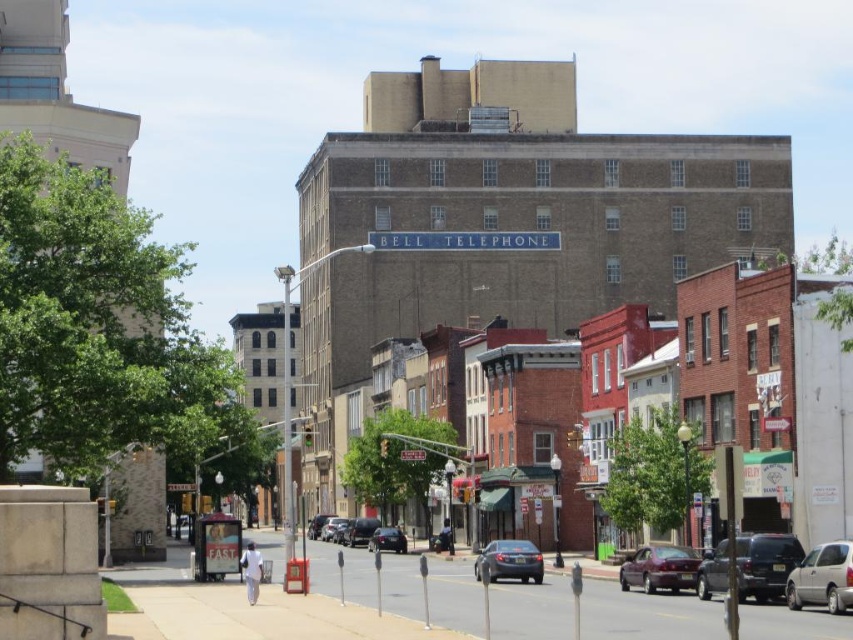
Is the position of gray asphalt at center less distant than that of shiny black car at center?

That is True.

Is point (413, 582) positioned after point (376, 525)?

No, (413, 582) is in front of (376, 525).

What do you see at coordinates (218, 588) in the screenshot? I see `gray asphalt at center` at bounding box center [218, 588].

In order to click on gray asphalt at center in this screenshot , I will do `click(218, 588)`.

Describe the element at coordinates (659, 568) in the screenshot. I see `shiny maroon sedan at lower right` at that location.

Between shiny maroon sedan at lower right and matte gray sedan at center, which one is positioned higher?

shiny maroon sedan at lower right is above.

You are a GUI agent. You are given a task and a screenshot of the screen. Output one action in this format:
    pyautogui.click(x=<x>, y=<y>)
    Task: Click on the shiny maroon sedan at lower right
    
    Given the screenshot: What is the action you would take?
    pyautogui.click(x=659, y=568)

This screenshot has width=853, height=640. I want to click on shiny maroon sedan at lower right, so click(659, 568).

Is shiny black car at center positioned behind shiny black sedan at center?

No, shiny black car at center is closer to the viewer.

Between point (358, 529) and point (329, 538), which one is positioned behind?

Positioned behind is point (329, 538).

The image size is (853, 640). Find the location of `shiny black car at center`. shiny black car at center is located at coordinates (358, 531).

The height and width of the screenshot is (640, 853). What are the coordinates of `shiny black car at center` in the screenshot? It's located at (358, 531).